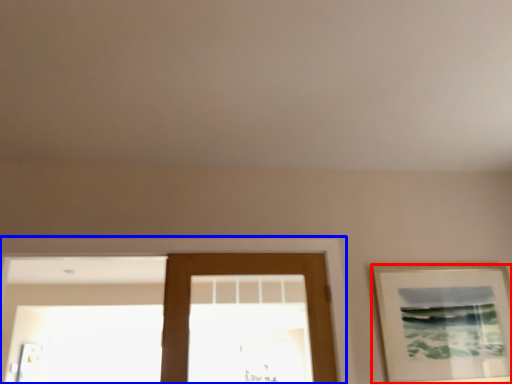
Question: Among these objects, which one is nearest to the camera, picture frame (highlighted by a red box) or window frame (highlighted by a blue box)?

Choices:
 (A) picture frame
 (B) window frame

Answer: (B)